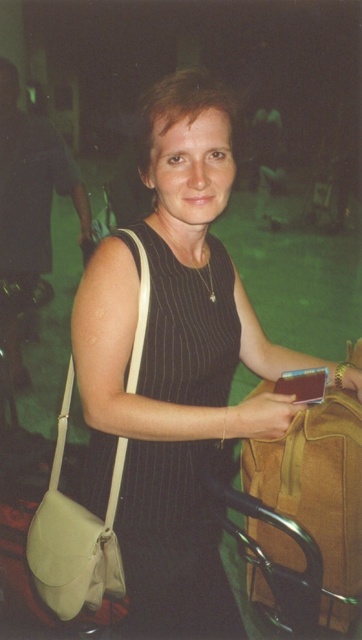
Can you confirm if black pinstripe dress at center is shorter than beige leather bag at left?

No, black pinstripe dress at center is not shorter than beige leather bag at left.

Is black pinstripe dress at center wider than beige leather bag at left?

Indeed, black pinstripe dress at center has a greater width compared to beige leather bag at left.

You are a GUI agent. You are given a task and a screenshot of the screen. Output one action in this format:
    pyautogui.click(x=<x>, y=<y>)
    Task: Click on the black pinstripe dress at center
    This screenshot has height=640, width=362.
    Given the screenshot: What is the action you would take?
    pyautogui.click(x=171, y=541)

Who is positioned more to the right, matte black dress at center or black pinstripe dress at center?

matte black dress at center

Between point (102, 400) and point (170, 356), which one is positioned in front?

Point (102, 400)

Is point (131, 557) positioned after point (177, 360)?

Yes, point (131, 557) is behind point (177, 360).

Locate an element on the screen. The height and width of the screenshot is (640, 362). matte black dress at center is located at coordinates (175, 364).

Who is more forward, (124, 289) or (93, 563)?

Point (124, 289) is in front.

Can you confirm if matte black dress at center is bigger than beige leather bag at left?

Yes.

What do you see at coordinates (175, 364) in the screenshot? This screenshot has height=640, width=362. I see `matte black dress at center` at bounding box center [175, 364].

Where is `matte black dress at center`? The height and width of the screenshot is (640, 362). matte black dress at center is located at coordinates (175, 364).